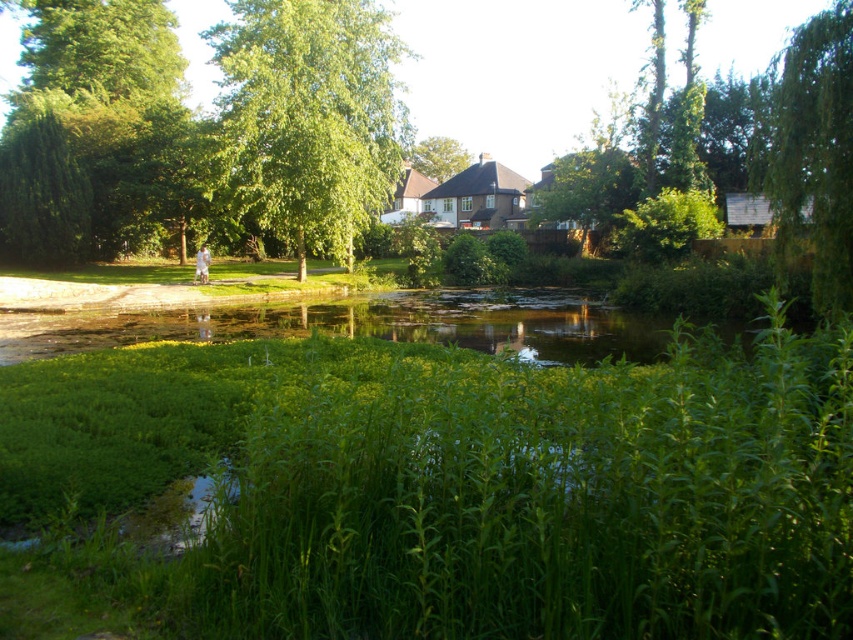
In the scene shown: Which is more to the right, green leafy grass at center or green leafy tree at center?

Positioned to the right is green leafy tree at center.

Does green leafy grass at center have a lesser height compared to green leafy tree at center?

Indeed, green leafy grass at center has a lesser height compared to green leafy tree at center.

Identify the location of green leafy grass at center. (430, 490).

Which is above, green leafy tree at upper left or green leafy tree at center?

green leafy tree at center is higher up.

Locate an element on the screen. The height and width of the screenshot is (640, 853). green leafy tree at upper left is located at coordinates (308, 116).

Find the location of a particular element. Image resolution: width=853 pixels, height=640 pixels. green leafy tree at upper left is located at coordinates tap(308, 116).

Which is in front, point (320, 212) or point (792, 166)?

Positioned in front is point (792, 166).

Which is above, green leafy tree at upper left or green leafy tree at right?

green leafy tree at upper left

The width and height of the screenshot is (853, 640). I want to click on green leafy tree at upper left, so click(x=308, y=116).

Find the location of `green leafy tree at upper left`. green leafy tree at upper left is located at coordinates (308, 116).